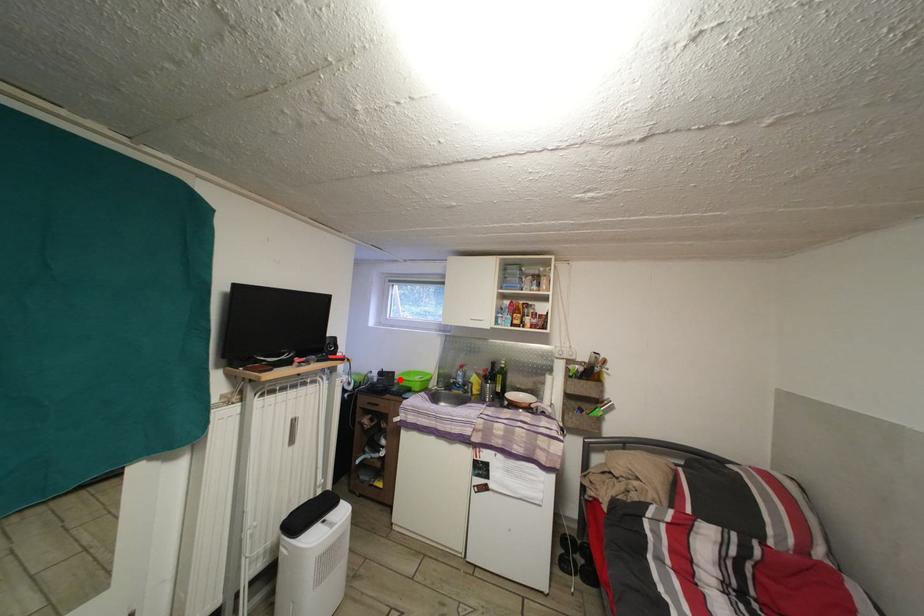
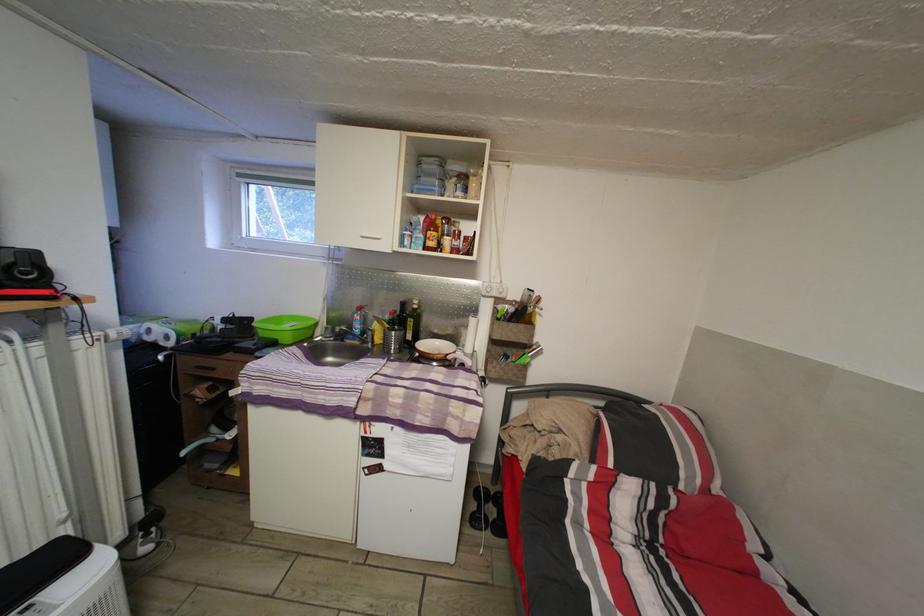
Question: I am providing you with two images of the same scene from different viewpoints. Image1 has a red point marked. In image2, the corresponding 3D location appears at what relative position? Reply with the corresponding letter.

Choices:
 (A) Closer
 (B) Farther

Answer: (A)